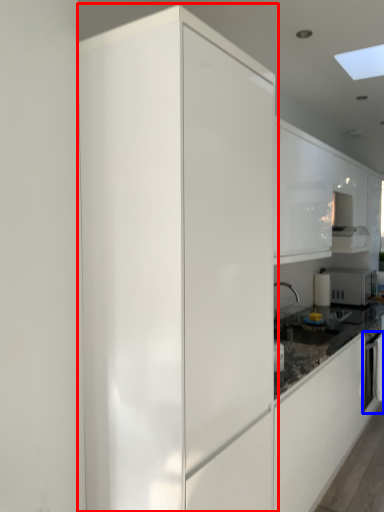
Question: Which object is further to the camera taking this photo, cabinetry (highlighted by a red box) or oven (highlighted by a blue box)?

Choices:
 (A) cabinetry
 (B) oven

Answer: (B)